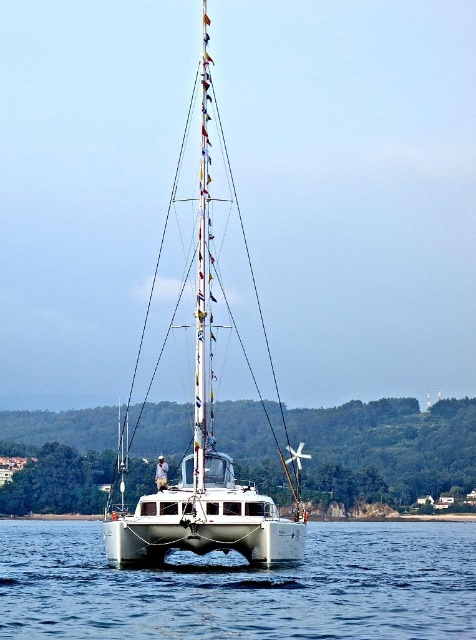
Question: Among these objects, which one is farthest from the camera?

Choices:
 (A) white glossy sailboat at center
 (B) clear blue water at center

Answer: (A)

Question: From the image, what is the correct spatial relationship of clear blue water at center in relation to white glossy sailboat at center?

Choices:
 (A) above
 (B) below

Answer: (B)

Question: Which point is farther to the camera?

Choices:
 (A) clear blue water at center
 (B) white glossy sailboat at center

Answer: (B)

Question: Does clear blue water at center appear over white glossy sailboat at center?

Choices:
 (A) no
 (B) yes

Answer: (A)

Question: From the image, what is the correct spatial relationship of clear blue water at center in relation to white glossy sailboat at center?

Choices:
 (A) above
 (B) below

Answer: (B)